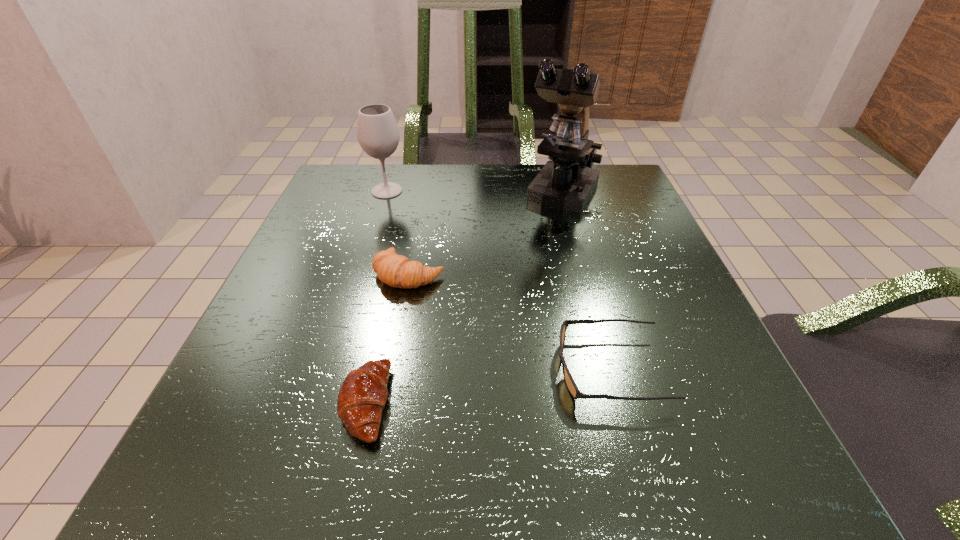
This screenshot has height=540, width=960. I want to click on vacant space that satisfies the following two spatial constraints: 1. on the back side of the tallest object; 2. on the left side of the farther crescent roll, so click(424, 194).

Where is `blank area in the image that satisfies the following two spatial constraints: 1. on the front side of the tallest object; 2. on the front-facing side of the sunglasses`? Image resolution: width=960 pixels, height=540 pixels. blank area in the image that satisfies the following two spatial constraints: 1. on the front side of the tallest object; 2. on the front-facing side of the sunglasses is located at coordinates (612, 369).